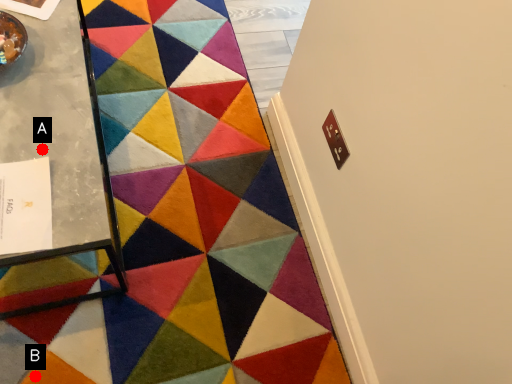
Question: Two points are circled on the image, labeled by A and B beside each circle. Which point is farther from the camera taking this photo?

Choices:
 (A) A is further
 (B) B is further

Answer: (B)